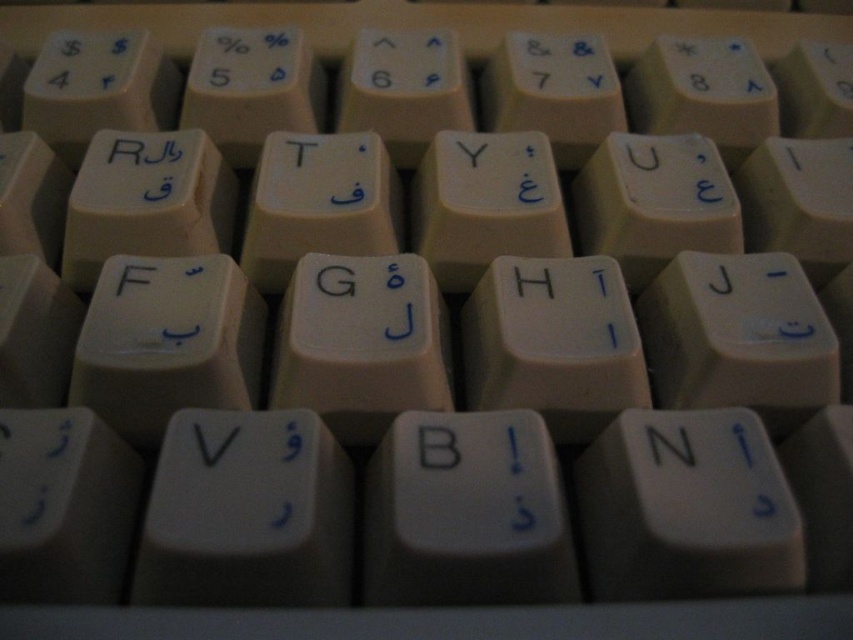
Which is above, white plastic letter g at center or white plastic letter h at center?

Positioned higher is white plastic letter h at center.

This screenshot has height=640, width=853. I want to click on white plastic letter g at center, so click(x=335, y=280).

Is white plastic letter b at center shorter than matte white key at upper left?

Yes.

Does point (447, 442) come in front of point (132, 145)?

Yes, it is in front of point (132, 145).

Identify the location of white plastic letter b at center. Image resolution: width=853 pixels, height=640 pixels. (437, 448).

Does black plastic letter v at center appear under white plastic letter h at center?

Indeed, black plastic letter v at center is positioned under white plastic letter h at center.

Looking at this image, is black plastic letter v at center to the right of white plastic letter h at center from the viewer's perspective?

Incorrect, black plastic letter v at center is not on the right side of white plastic letter h at center.

What are the coordinates of `black plastic letter v at center` in the screenshot? It's located at (213, 444).